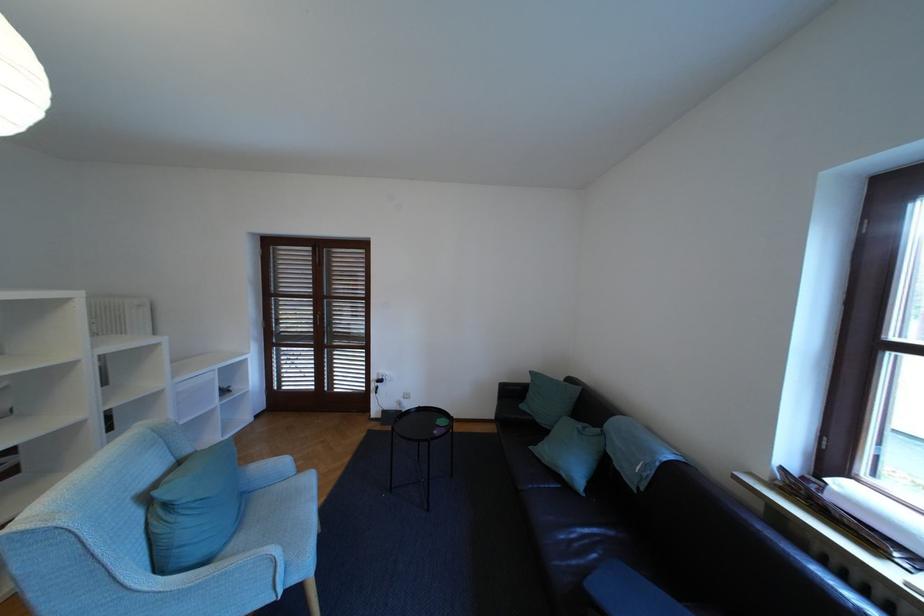
Locate an element on the screen. blue pillow is located at coordinates (195, 509).